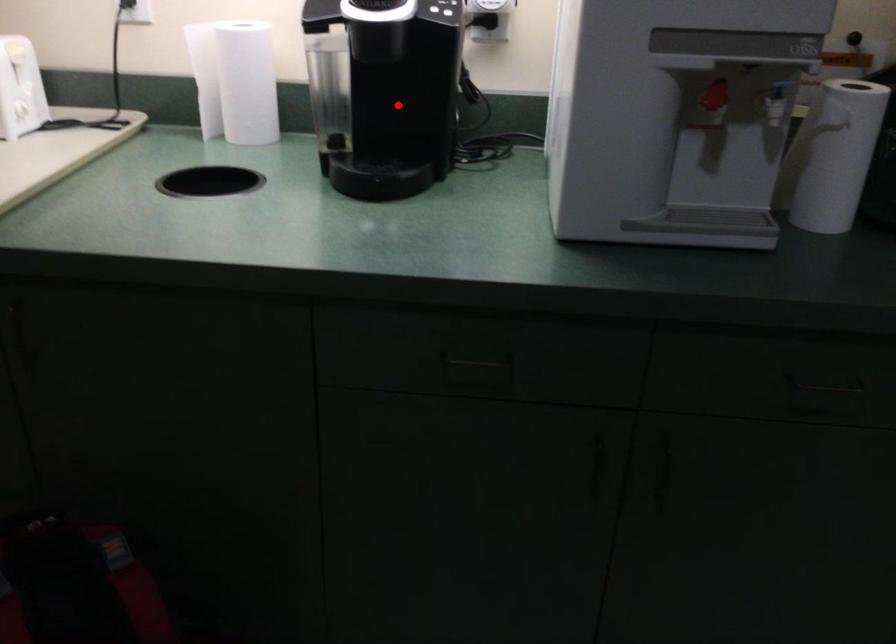
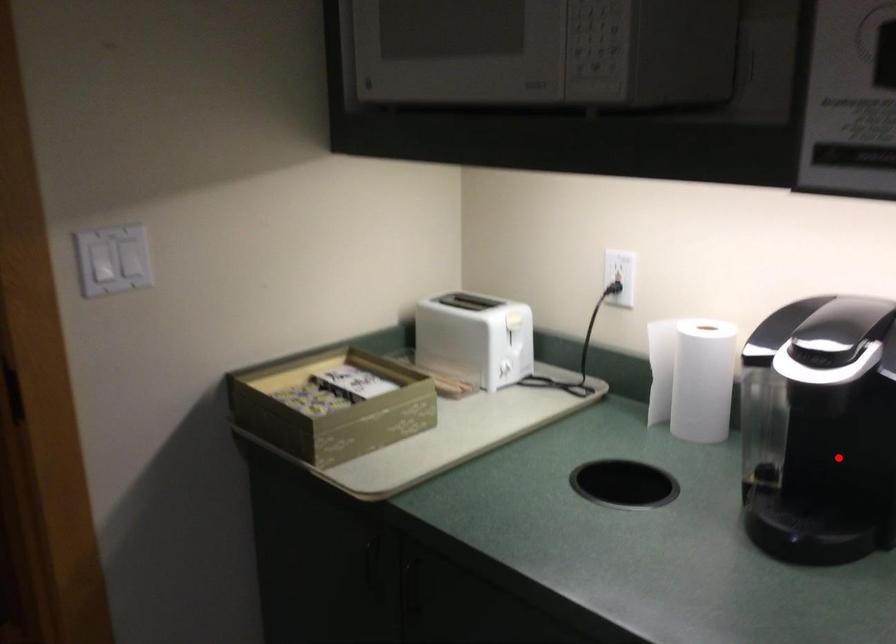
I am providing you with two images of the same scene from different viewpoints. A red point is marked on the first image and another point is marked on the second image. Is the marked point in image1 the same physical position as the marked point in image2?

Yes